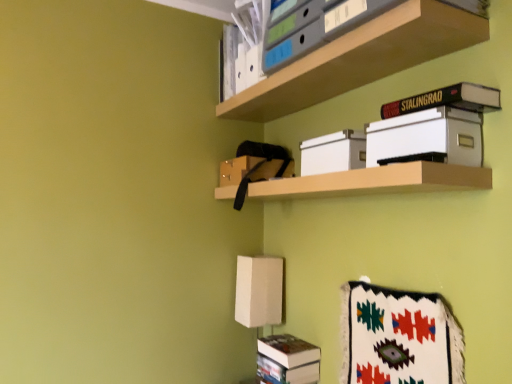
Question: From the image's perspective, is beige fabric lampshade at lower center above or below white cardboard box at center?

Choices:
 (A) below
 (B) above

Answer: (A)

Question: Is point (241, 279) positioned closer to the camera than point (335, 155)?

Choices:
 (A) closer
 (B) farther

Answer: (B)

Question: Which is farther from the hardcover black book at upper right?

Choices:
 (A) white cardboard box at center
 (B) wooden shelf at center, the 1th shelf from the bottom
 (C) white woven blanket at lower right
 (D) matte plastic folders at upper center, which is the 1th shelf in top-to-bottom order
 (E) beige fabric lampshade at lower center

Answer: (E)

Question: Considering the real-world distances, which object is closest to the white cardboard box at center?

Choices:
 (A) white woven blanket at lower right
 (B) matte plastic folders at upper center, which ranks as the 2th shelf in bottom-to-top order
 (C) wooden shelf at center, which ranks as the 2th shelf in top-to-bottom order
 (D) hardcover black book at upper right
 (E) beige fabric lampshade at lower center

Answer: (C)